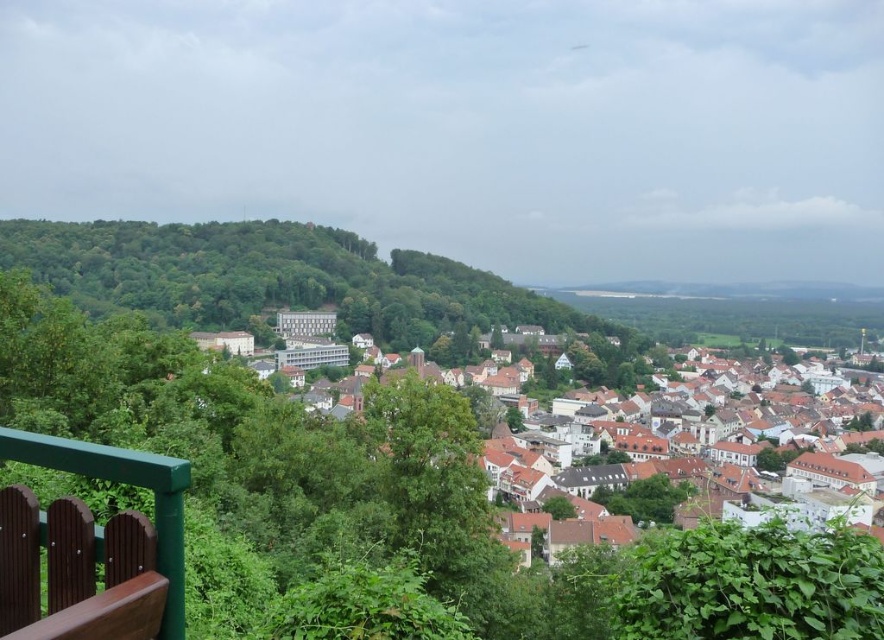
Question: Which object appears closest to the camera in this image?

Choices:
 (A) white matte building at center
 (B) brown wooden rail at lower left

Answer: (B)

Question: Among these objects, which one is farthest from the camera?

Choices:
 (A) white matte building at center
 (B) brown wooden rail at lower left

Answer: (A)

Question: Is white matte building at center wider than brown wooden rail at lower left?

Choices:
 (A) no
 (B) yes

Answer: (B)

Question: Which point is closer to the camera?

Choices:
 (A) (1, 435)
 (B) (537, 486)

Answer: (A)

Question: Does white matte building at center appear on the left side of brown wooden rail at lower left?

Choices:
 (A) no
 (B) yes

Answer: (A)

Question: Does white matte building at center have a smaller size compared to brown wooden rail at lower left?

Choices:
 (A) no
 (B) yes

Answer: (A)